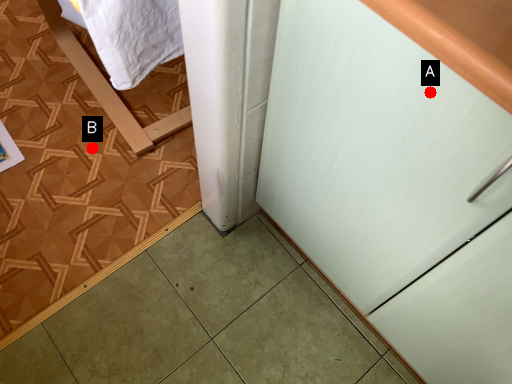
Question: Two points are circled on the image, labeled by A and B beside each circle. Which point appears closest to the camera in this image?

Choices:
 (A) A is closer
 (B) B is closer

Answer: (A)